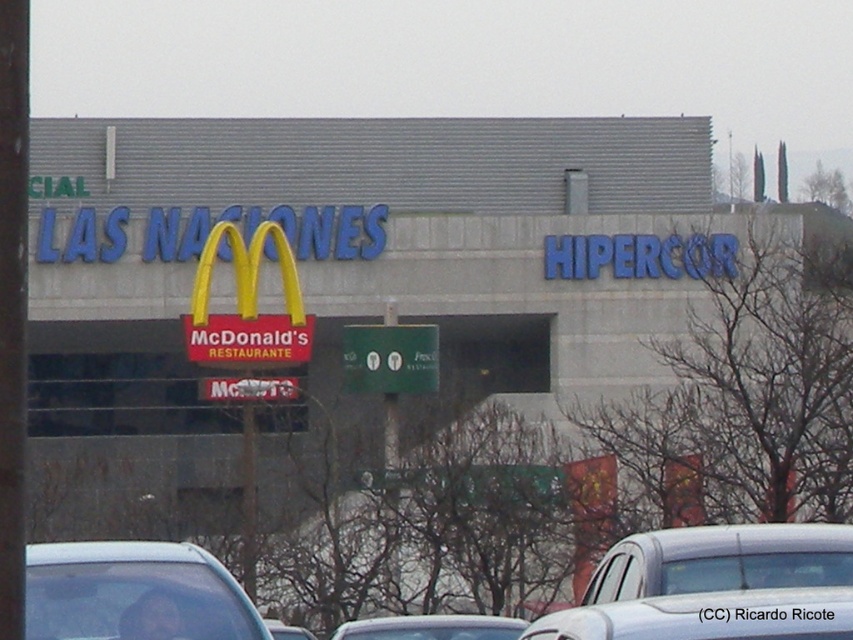
Does white matte car at lower center have a greater height compared to white glossy car at center?

Yes.

Is white matte car at lower center to the left of white glossy car at center from the viewer's perspective?

Incorrect, white matte car at lower center is not on the left side of white glossy car at center.

Does point (825, 538) come in front of point (782, 595)?

No, it is not.

In order to click on white matte car at lower center in this screenshot , I will do `click(718, 560)`.

Is clear glass car at lower left bigger than white matte car at lower center?

No.

The width and height of the screenshot is (853, 640). What are the coordinates of `clear glass car at lower left` in the screenshot? It's located at (132, 593).

I want to click on clear glass car at lower left, so click(132, 593).

Is green matte sign at center to the right of silver metallic car at center from the viewer's perspective?

Incorrect, green matte sign at center is not on the right side of silver metallic car at center.

Can you confirm if green matte sign at center is shorter than silver metallic car at center?

Correct, green matte sign at center is not as tall as silver metallic car at center.

I want to click on green matte sign at center, so click(390, 358).

You are a GUI agent. You are given a task and a screenshot of the screen. Output one action in this format:
    pyautogui.click(x=<x>, y=<y>)
    Task: Click on the green matte sign at center
    The image size is (853, 640).
    Given the screenshot: What is the action you would take?
    pyautogui.click(x=390, y=358)